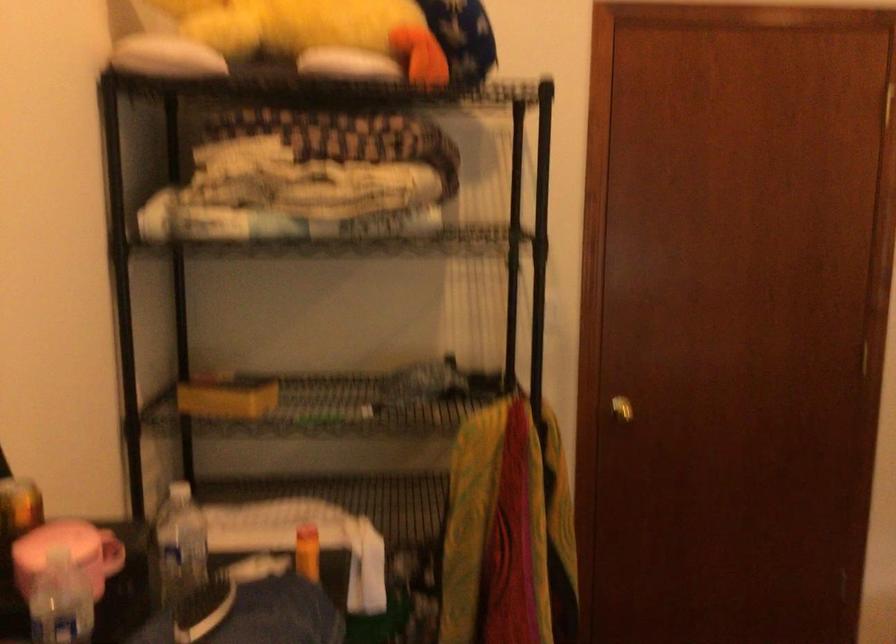
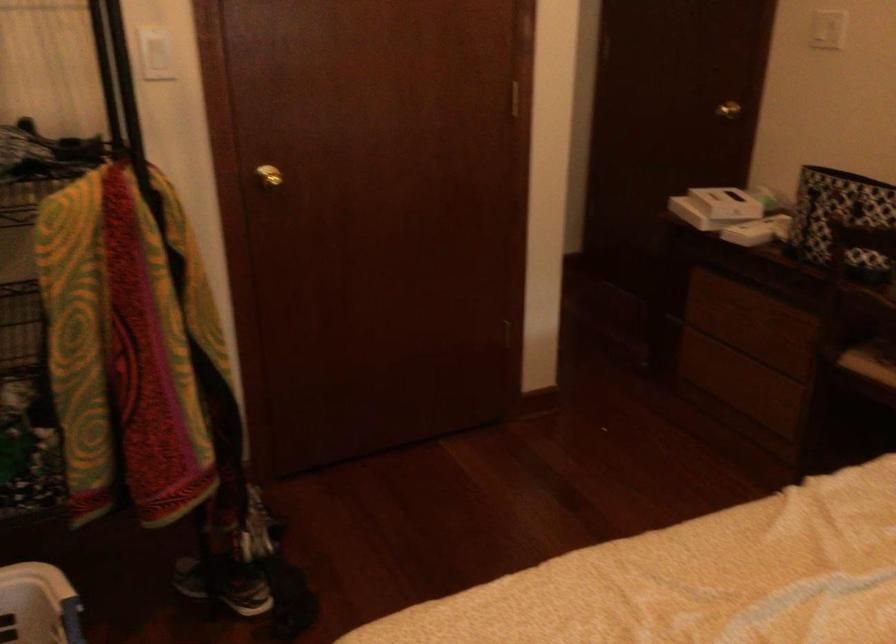
Locate, in the second image, the point that corresponds to (549,305) in the first image.

(156, 55)